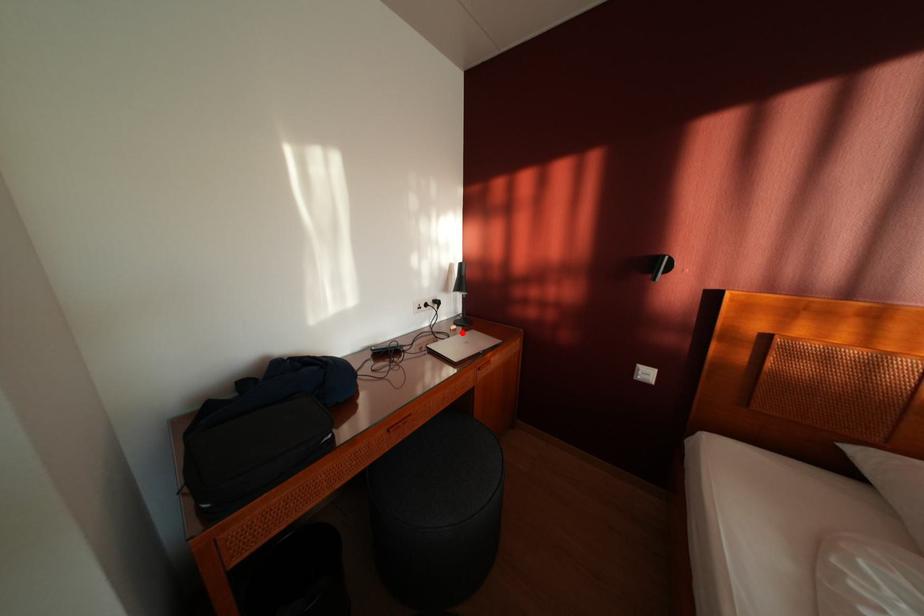
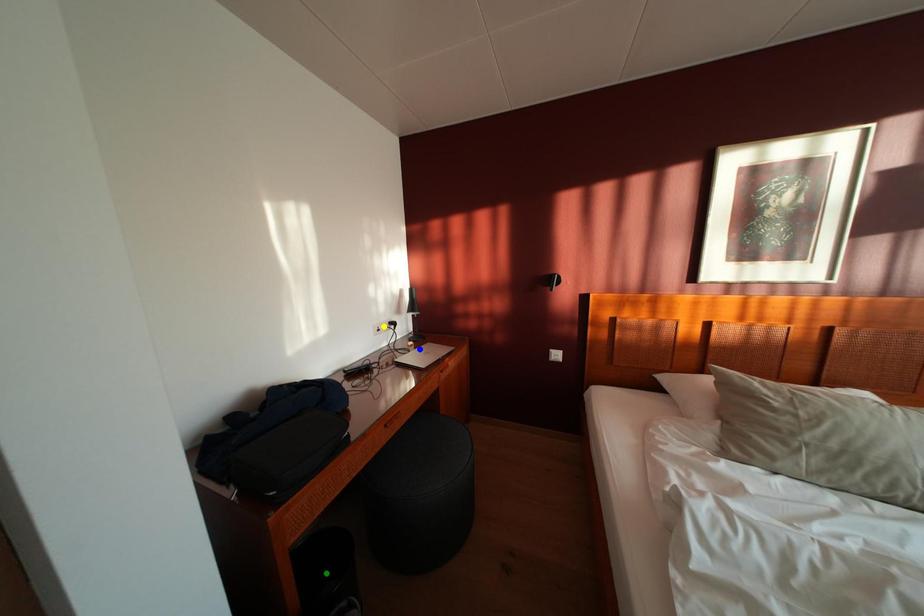
Question: I am providing you with two images of the same scene from different viewpoints. A red point is marked on the first image. You are given multiple points on the second image. Can you choose the point in image 2 that corresponds to the point in image 1?

Choices:
 (A) blue point
 (B) green point
 (C) yellow point

Answer: (A)